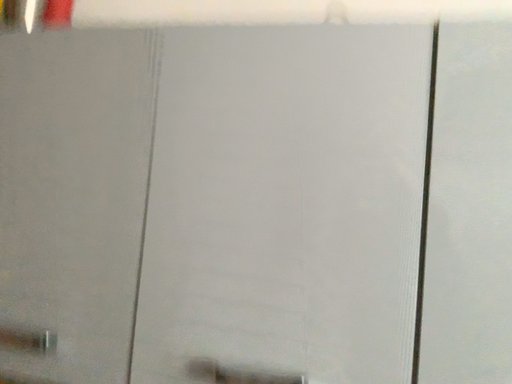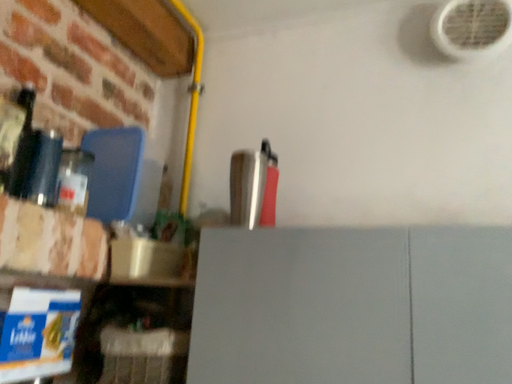
Question: How did the camera likely rotate when shooting the video?

Choices:
 (A) rotated downward
 (B) rotated upward

Answer: (B)